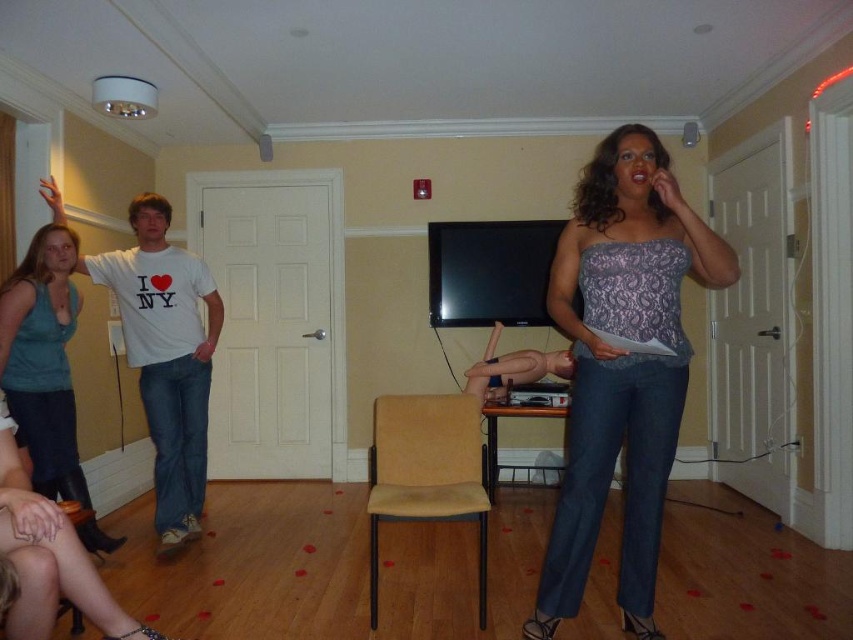
Is white cotton t-shirt at left thinner than teal matte tank top at left?

No, white cotton t-shirt at left is not thinner than teal matte tank top at left.

Measure the distance from white cotton t-shirt at left to teal matte tank top at left.

white cotton t-shirt at left is 15.72 inches from teal matte tank top at left.

What do you see at coordinates (166, 355) in the screenshot? The height and width of the screenshot is (640, 853). I see `white cotton t-shirt at left` at bounding box center [166, 355].

Where is `white cotton t-shirt at left`? This screenshot has width=853, height=640. white cotton t-shirt at left is located at coordinates point(166,355).

Between lace fabric top at center and white cotton t-shirt at left, which one is positioned lower?

white cotton t-shirt at left is lower down.

Which is above, lace fabric top at center or white cotton t-shirt at left?

Positioned higher is lace fabric top at center.

You are a GUI agent. You are given a task and a screenshot of the screen. Output one action in this format:
    pyautogui.click(x=<x>, y=<y>)
    Task: Click on the lace fabric top at center
    
    Given the screenshot: What is the action you would take?
    pyautogui.click(x=622, y=365)

Between lace fabric top at center and teal matte tank top at left, which one has less height?

Standing shorter between the two is teal matte tank top at left.

Does lace fabric top at center have a smaller size compared to teal matte tank top at left?

Incorrect, lace fabric top at center is not smaller in size than teal matte tank top at left.

The height and width of the screenshot is (640, 853). What do you see at coordinates (622, 365) in the screenshot? I see `lace fabric top at center` at bounding box center [622, 365].

Identify the location of lace fabric top at center. This screenshot has height=640, width=853. pyautogui.click(x=622, y=365).